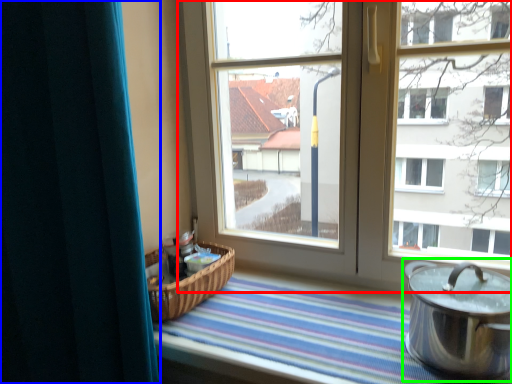
Question: Which object is positioned farthest from window (highlighted by a red box)? Select from curtain (highlighted by a blue box) and crock pot (highlighted by a green box).

Choices:
 (A) curtain
 (B) crock pot

Answer: (A)